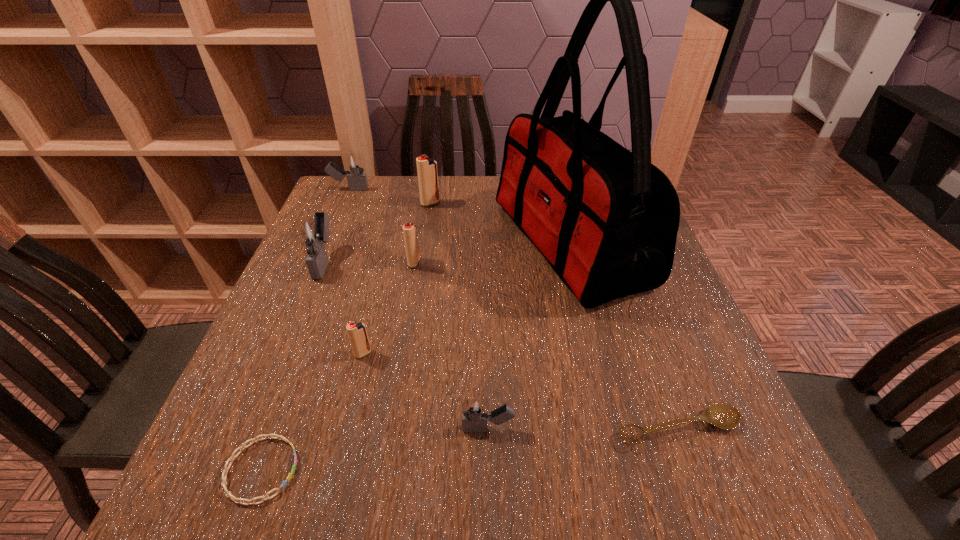
You are a GUI agent. You are given a task and a screenshot of the screen. Output one action in this format:
    pyautogui.click(x=<x>, y=<y>)
    Task: Click on the red duffel bag
    The width and height of the screenshot is (960, 540).
    Given the screenshot: What is the action you would take?
    pyautogui.click(x=606, y=219)

The width and height of the screenshot is (960, 540). In order to click on duffel bag in this screenshot , I will do [606, 219].

Identify the location of the second farthest igniter. (426, 167).

I want to click on the farthest red igniter, so click(426, 167).

Identify the location of the second farthest gray igniter. The image size is (960, 540). (312, 233).

Locate an element on the screen. the second smallest gray igniter is located at coordinates (353, 163).

Locate an element on the screen. This screenshot has height=540, width=960. the farthest igniter is located at coordinates (353, 163).

At what (x,y) coordinates should I click in order to perform the action: click on the second biggest red igniter. Please return your answer as a coordinate pair (x, y). Looking at the image, I should click on (409, 229).

This screenshot has height=540, width=960. Find the location of `the leftmost red igniter`. the leftmost red igniter is located at coordinates (357, 332).

This screenshot has height=540, width=960. Find the location of `the third igniter from left to right`. the third igniter from left to right is located at coordinates (357, 332).